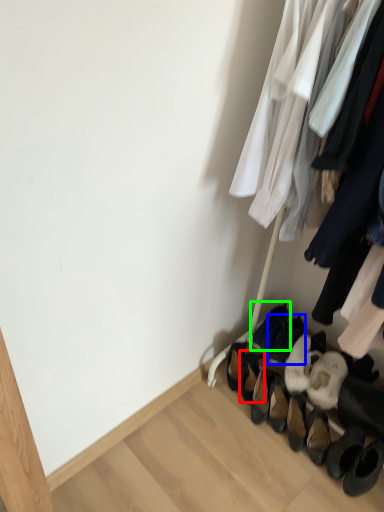
Question: Which is nearer to the footwear (highlighted by a red box)? footwear (highlighted by a blue box) or footwear (highlighted by a green box).

Choices:
 (A) footwear
 (B) footwear

Answer: (B)